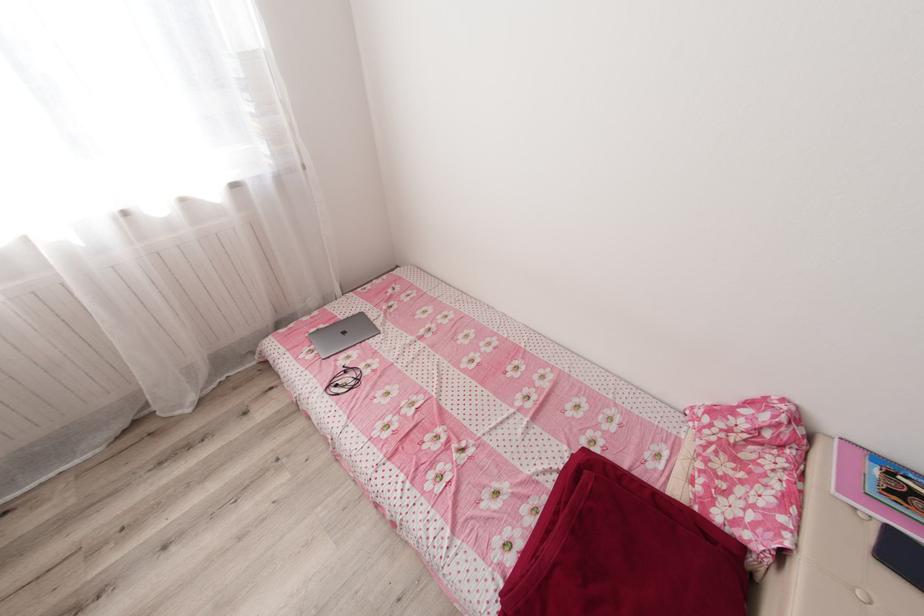
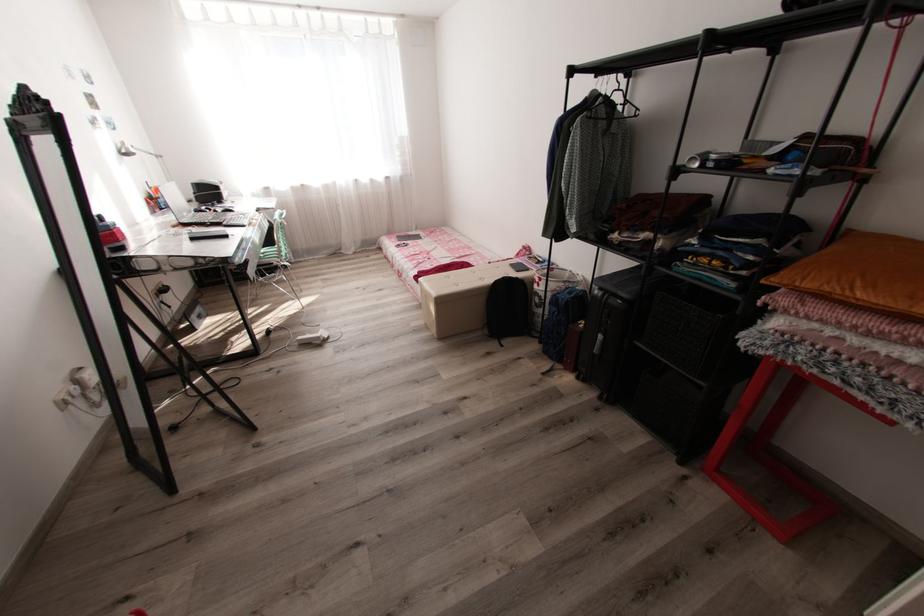
Based on the photo, what movement of the cameraman would produce the second image?

The cameraman walked toward right, backward.